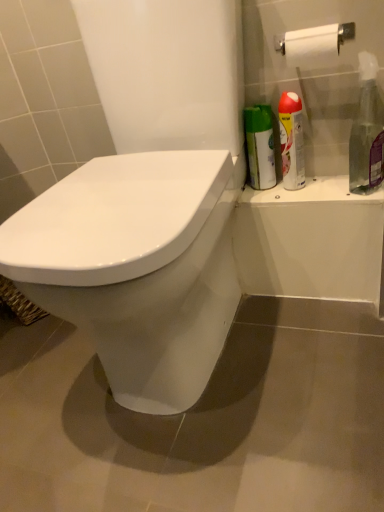
What do you see at coordinates (367, 131) in the screenshot?
I see `clear plastic spray bottle at right, the first cleaning product from the right` at bounding box center [367, 131].

What do you see at coordinates (291, 140) in the screenshot? This screenshot has height=512, width=384. I see `silver metallic spray can at upper right, which is the 1th cleaning product from left to right` at bounding box center [291, 140].

Locate an element on the screen. white glossy toilet at center is located at coordinates pyautogui.click(x=136, y=268).

At what (x,y) coordinates should I click in order to perform the action: click on clear plastic spray bottle at right, the first cleaning product from the right. Please return your answer as a coordinate pair (x, y). The height and width of the screenshot is (512, 384). Looking at the image, I should click on (367, 131).

How different are the orientations of silver metallic spray can at upper right, which is the 1th cleaning product from left to right, and clear plastic spray bottle at right, the first cleaning product from the right, in degrees?

The angle between the facing direction of silver metallic spray can at upper right, which is the 1th cleaning product from left to right, and the facing direction of clear plastic spray bottle at right, the first cleaning product from the right, is 0.00385 degrees.

Is silver metallic spray can at upper right, which is the 1th cleaning product from left to right, positioned behind clear plastic spray bottle at right, the first cleaning product from the right?

Yes, it is.

Identify the location of cleaning product on the right of silver metallic spray can at upper right, the 2th cleaning product in the right-to-left sequence. This screenshot has width=384, height=512. (367, 131).

Is silver metallic spray can at upper right, the 2th cleaning product in the right-to-left sequence, oriented away from clear plastic spray bottle at right, the first cleaning product from the right?

silver metallic spray can at upper right, the 2th cleaning product in the right-to-left sequence, does not have its back to clear plastic spray bottle at right, the first cleaning product from the right.

Is the depth of clear plastic spray bottle at right, marked as the 2th cleaning product in a left-to-right arrangement, less than that of silver metallic spray can at upper right, which is the 1th cleaning product from left to right?

Yes, it is.

Does clear plastic spray bottle at right, marked as the 2th cleaning product in a left-to-right arrangement, touch silver metallic spray can at upper right, the 2th cleaning product in the right-to-left sequence?

No, clear plastic spray bottle at right, marked as the 2th cleaning product in a left-to-right arrangement, is not next to silver metallic spray can at upper right, the 2th cleaning product in the right-to-left sequence.

Is point (358, 121) less distant than point (291, 117)?

No, (358, 121) is further to viewer.

In terms of height, does clear plastic spray bottle at right, the first cleaning product from the right, look taller or shorter compared to silver metallic spray can at upper right, the 2th cleaning product in the right-to-left sequence?

Considering their sizes, clear plastic spray bottle at right, the first cleaning product from the right, has more height than silver metallic spray can at upper right, the 2th cleaning product in the right-to-left sequence.

Considering the relative positions of white glossy toilet at center and silver metallic spray can at upper right, the 2th cleaning product in the right-to-left sequence, in the image provided, is white glossy toilet at center in front of silver metallic spray can at upper right, the 2th cleaning product in the right-to-left sequence,?

Yes, white glossy toilet at center is closer to the viewer.

Does point (27, 216) come behind point (286, 143)?

No, (27, 216) is in front of (286, 143).

Starting from the white glossy toilet at center, which cleaning product is the 2nd one behind? Please provide its 2D coordinates.

[(291, 140)]

Would you say white glossy toilet at center is outside silver metallic spray can at upper right, the 2th cleaning product in the right-to-left sequence?

That's correct, white glossy toilet at center is outside of silver metallic spray can at upper right, the 2th cleaning product in the right-to-left sequence.

Is clear plastic spray bottle at right, the first cleaning product from the right, to the left of white glossy toilet at center from the viewer's perspective?

Incorrect, clear plastic spray bottle at right, the first cleaning product from the right, is not on the left side of white glossy toilet at center.

Is clear plastic spray bottle at right, marked as the 2th cleaning product in a left-to-right arrangement, not inside white glossy toilet at center?

clear plastic spray bottle at right, marked as the 2th cleaning product in a left-to-right arrangement, lies outside white glossy toilet at center's area.

Is clear plastic spray bottle at right, the first cleaning product from the right, beside white glossy toilet at center?

No, clear plastic spray bottle at right, the first cleaning product from the right, is not next to white glossy toilet at center.

Between white glossy toilet at center and clear plastic spray bottle at right, marked as the 2th cleaning product in a left-to-right arrangement, which one has larger width?

Wider between the two is white glossy toilet at center.

Which is more to the left, white glossy toilet at center or clear plastic spray bottle at right, the first cleaning product from the right?

white glossy toilet at center.

From a real-world perspective, is white glossy toilet at center physically above clear plastic spray bottle at right, the first cleaning product from the right?

Incorrect, from a real-world perspective, white glossy toilet at center is lower than clear plastic spray bottle at right, the first cleaning product from the right.

Does silver metallic spray can at upper right, which is the 1th cleaning product from left to right, appear on the left side of white glossy toilet at center?

No.

From the image's perspective, which one is positioned higher, silver metallic spray can at upper right, which is the 1th cleaning product from left to right, or white glossy toilet at center?

silver metallic spray can at upper right, which is the 1th cleaning product from left to right, is shown above in the image.

Is silver metallic spray can at upper right, the 2th cleaning product in the right-to-left sequence, located outside white glossy toilet at center?

Indeed, silver metallic spray can at upper right, the 2th cleaning product in the right-to-left sequence, is completely outside white glossy toilet at center.

Is white glossy toilet at center at the back of silver metallic spray can at upper right, the 2th cleaning product in the right-to-left sequence?

No, white glossy toilet at center is not at the back of silver metallic spray can at upper right, the 2th cleaning product in the right-to-left sequence.

You are a GUI agent. You are given a task and a screenshot of the screen. Output one action in this format:
    pyautogui.click(x=<x>, y=<y>)
    Task: Click on the cleaning product that appears above the silver metallic spray can at upper right, which is the 1th cleaning product from left to right (from a real-world perspective)
    The width and height of the screenshot is (384, 512).
    Given the screenshot: What is the action you would take?
    pyautogui.click(x=367, y=131)

This screenshot has height=512, width=384. Identify the location of cleaning product below the silver metallic spray can at upper right, which is the 1th cleaning product from left to right (from the image's perspective). (367, 131).

Estimate the real-world distances between objects in this image. Which object is closer to white glossy toilet at center, silver metallic spray can at upper right, the 2th cleaning product in the right-to-left sequence, or clear plastic spray bottle at right, the first cleaning product from the right?

silver metallic spray can at upper right, the 2th cleaning product in the right-to-left sequence, is closer to white glossy toilet at center.

Considering their positions, is clear plastic spray bottle at right, the first cleaning product from the right, positioned closer to silver metallic spray can at upper right, the 2th cleaning product in the right-to-left sequence, than white glossy toilet at center?

clear plastic spray bottle at right, the first cleaning product from the right, is positioned closer to the anchor silver metallic spray can at upper right, the 2th cleaning product in the right-to-left sequence.

Based on their spatial positions, is silver metallic spray can at upper right, the 2th cleaning product in the right-to-left sequence, or white glossy toilet at center closer to clear plastic spray bottle at right, marked as the 2th cleaning product in a left-to-right arrangement?

silver metallic spray can at upper right, the 2th cleaning product in the right-to-left sequence, lies closer to clear plastic spray bottle at right, marked as the 2th cleaning product in a left-to-right arrangement, than the other object.

Estimate the real-world distances between objects in this image. Which object is closer to silver metallic spray can at upper right, the 2th cleaning product in the right-to-left sequence, white glossy toilet at center or clear plastic spray bottle at right, the first cleaning product from the right?

clear plastic spray bottle at right, the first cleaning product from the right, is closer to silver metallic spray can at upper right, the 2th cleaning product in the right-to-left sequence.

Which object lies further to the anchor point clear plastic spray bottle at right, the first cleaning product from the right, white glossy toilet at center or silver metallic spray can at upper right, the 2th cleaning product in the right-to-left sequence?

white glossy toilet at center is positioned further to the anchor clear plastic spray bottle at right, the first cleaning product from the right.

Based on their spatial positions, is clear plastic spray bottle at right, the first cleaning product from the right, or silver metallic spray can at upper right, the 2th cleaning product in the right-to-left sequence, further from white glossy toilet at center?

clear plastic spray bottle at right, the first cleaning product from the right, is further to white glossy toilet at center.

Locate an element on the screen. The height and width of the screenshot is (512, 384). cleaning product positioned between white glossy toilet at center and silver metallic spray can at upper right, which is the 1th cleaning product from left to right, from near to far is located at coordinates (367, 131).